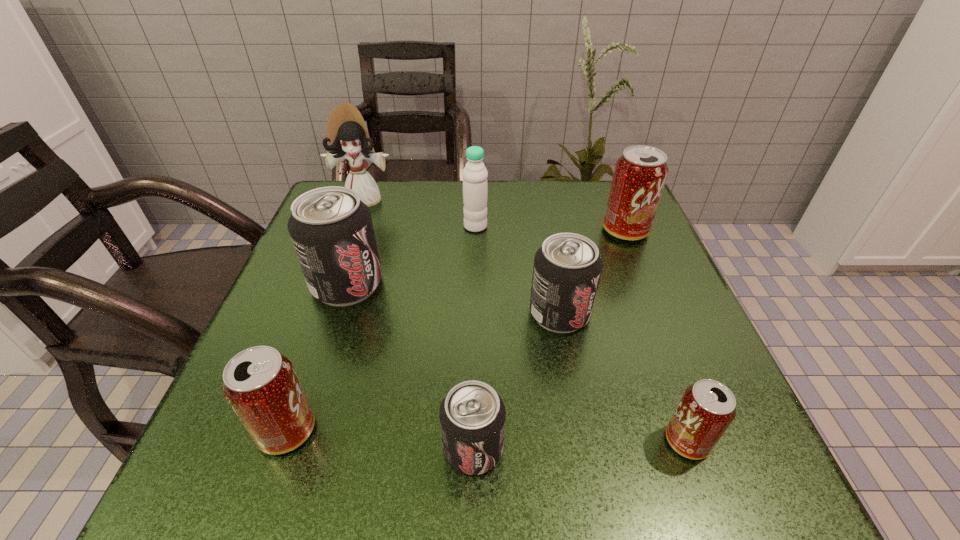
I want to click on doll that is positioned at the far edge, so click(x=347, y=136).

Find the location of a particular element. The width and height of the screenshot is (960, 540). water bottle located in the far edge section of the desktop is located at coordinates (475, 189).

I want to click on soda can situated at the far edge, so click(640, 174).

Locate an element on the screen. doll that is positioned at the left edge is located at coordinates (347, 136).

Locate an element on the screen. The image size is (960, 540). object located in the far left corner section of the desktop is located at coordinates (347, 136).

Identify the location of object present at the near left corner. The height and width of the screenshot is (540, 960). (260, 384).

Find the location of a particular element. The width and height of the screenshot is (960, 540). object present at the far right corner is located at coordinates [x=640, y=174].

I want to click on object that is at the near right corner, so click(x=707, y=408).

This screenshot has height=540, width=960. In order to click on free space at the far edge in this screenshot , I will do `click(417, 188)`.

You are a GUI agent. You are given a task and a screenshot of the screen. Output one action in this format:
    pyautogui.click(x=<x>, y=<y>)
    Task: Click on the free region at the near edge of the desktop
    This screenshot has height=540, width=960.
    Given the screenshot: What is the action you would take?
    pyautogui.click(x=652, y=489)